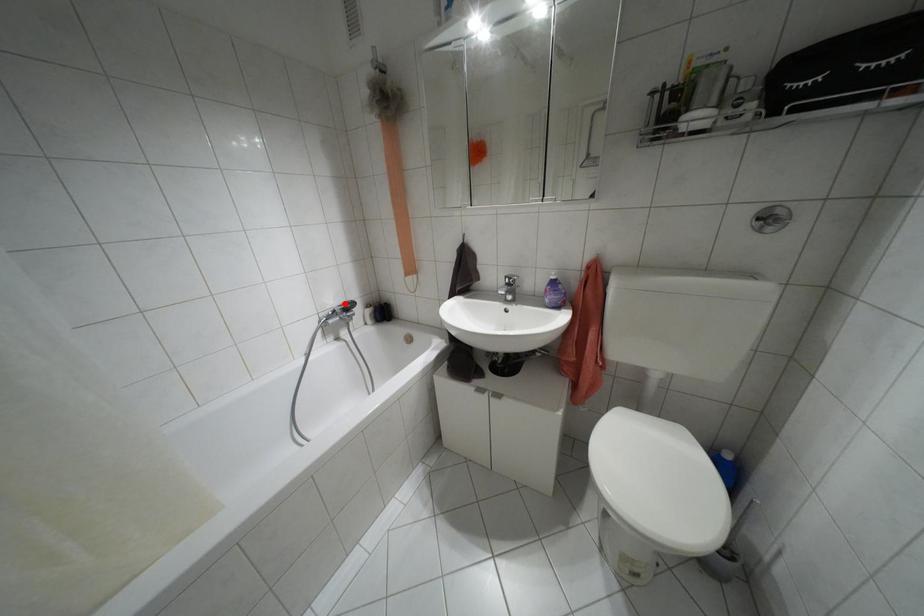
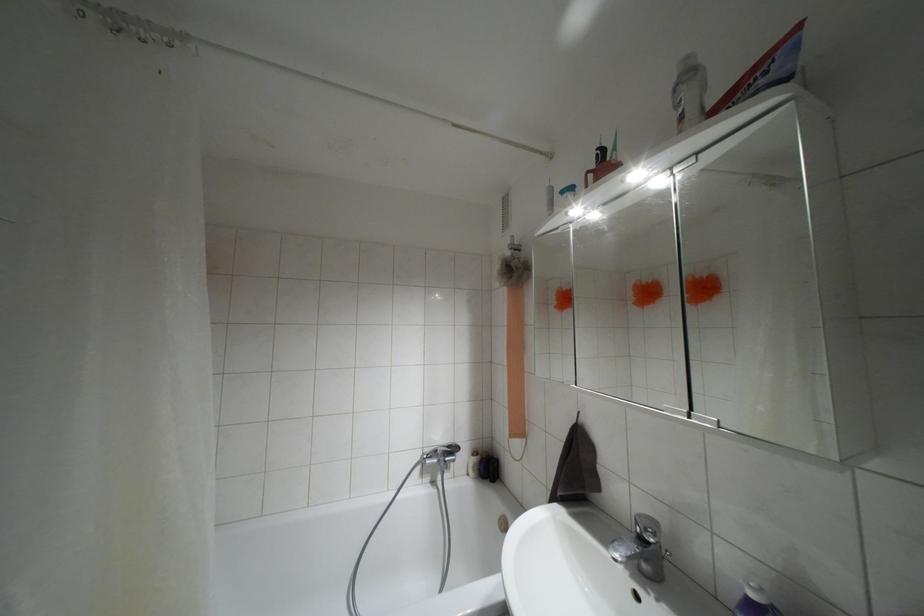
Question: A red point is marked in image1. In image2, is the corresponding 3D point closer to the camera or farther? Reply with the corresponding letter.

Choices:
 (A) The corresponding 3D point is closer.
 (B) The corresponding 3D point is farther.

Answer: (B)